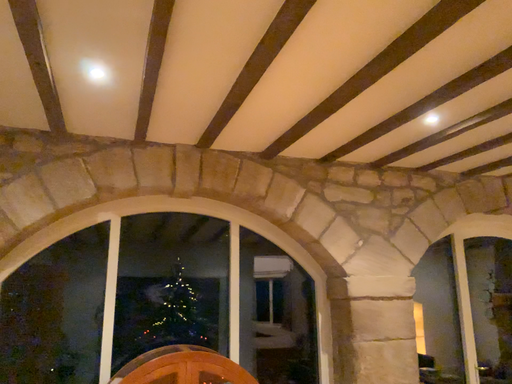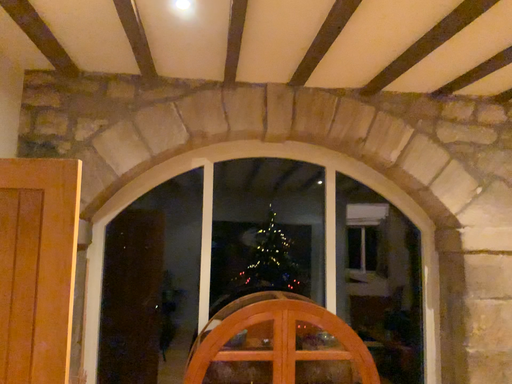
Question: Which way did the camera rotate in the video?

Choices:
 (A) rotated downward
 (B) rotated upward

Answer: (A)